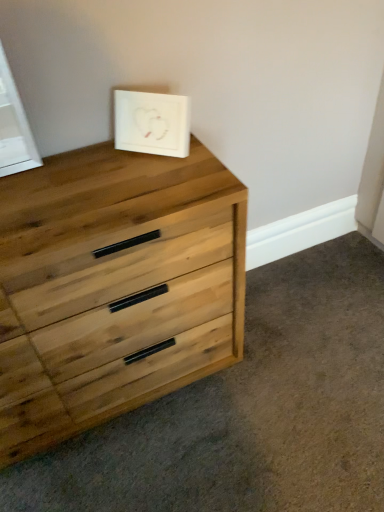
Question: From the image's perspective, is natural wood chest of drawers at upper left on top of white matte picture frame at upper center?

Choices:
 (A) yes
 (B) no

Answer: (B)

Question: Can you confirm if natural wood chest of drawers at upper left is positioned to the right of white matte picture frame at upper center?

Choices:
 (A) no
 (B) yes

Answer: (A)

Question: Does natural wood chest of drawers at upper left have a lesser width compared to white matte picture frame at upper center?

Choices:
 (A) yes
 (B) no

Answer: (B)

Question: Is natural wood chest of drawers at upper left surrounding white matte picture frame at upper center?

Choices:
 (A) yes
 (B) no

Answer: (B)

Question: Is natural wood chest of drawers at upper left outside white matte picture frame at upper center?

Choices:
 (A) no
 (B) yes

Answer: (B)

Question: Considering the relative sizes of natural wood chest of drawers at upper left and white matte picture frame at upper center in the image provided, is natural wood chest of drawers at upper left smaller than white matte picture frame at upper center?

Choices:
 (A) yes
 (B) no

Answer: (B)

Question: Considering the relative sizes of white matte picture frame at upper center and natural wood chest of drawers at upper left in the image provided, is white matte picture frame at upper center shorter than natural wood chest of drawers at upper left?

Choices:
 (A) no
 (B) yes

Answer: (B)

Question: Is white matte picture frame at upper center not within natural wood chest of drawers at upper left?

Choices:
 (A) yes
 (B) no

Answer: (A)

Question: Is white matte picture frame at upper center oriented towards natural wood chest of drawers at upper left?

Choices:
 (A) yes
 (B) no

Answer: (B)

Question: Considering the relative positions of white matte picture frame at upper center and natural wood chest of drawers at upper left in the image provided, is white matte picture frame at upper center to the right of natural wood chest of drawers at upper left from the viewer's perspective?

Choices:
 (A) yes
 (B) no

Answer: (A)

Question: Is white matte picture frame at upper center turned away from natural wood chest of drawers at upper left?

Choices:
 (A) no
 (B) yes

Answer: (A)

Question: Can you confirm if white matte picture frame at upper center is thinner than natural wood chest of drawers at upper left?

Choices:
 (A) yes
 (B) no

Answer: (A)

Question: Is white matte picture frame at upper center wider or thinner than natural wood chest of drawers at upper left?

Choices:
 (A) thin
 (B) wide

Answer: (A)